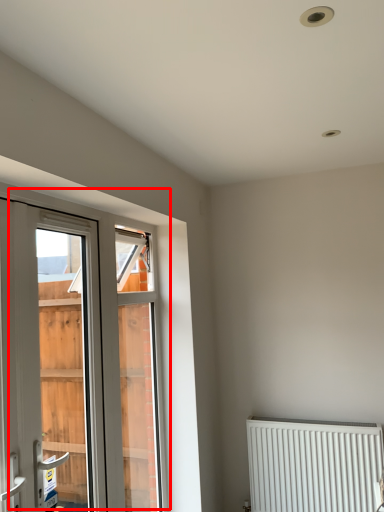
Question: Where is window (annotated by the red box) located in relation to radiator in the image?

Choices:
 (A) right
 (B) left

Answer: (B)